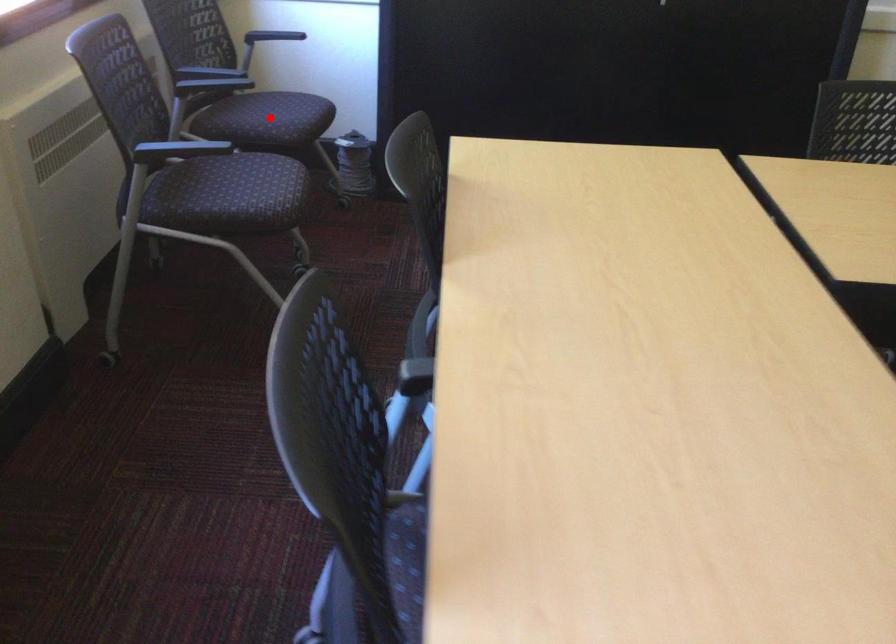
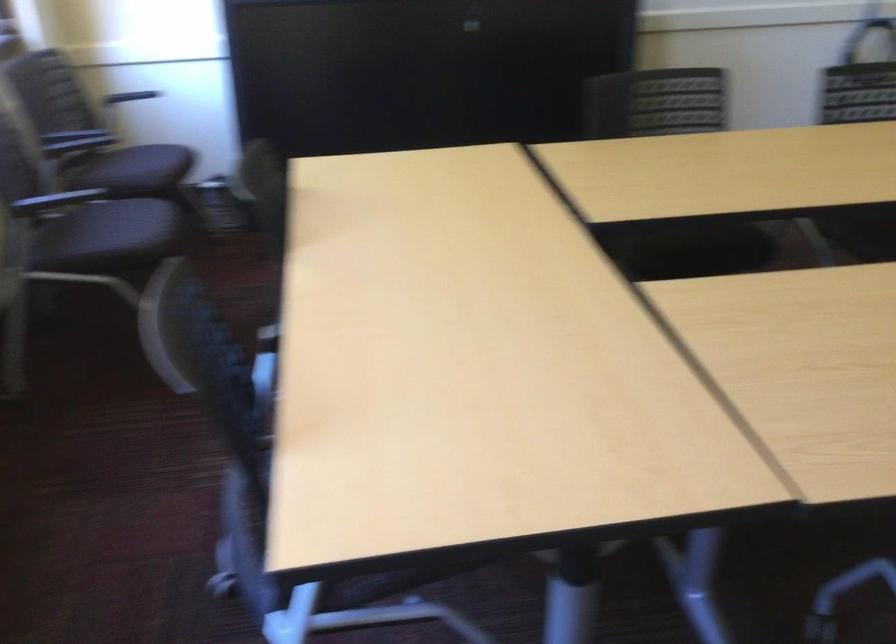
Question: I am providing you with two images of the same scene from different viewpoints. Given a red point in image1, look at the same physical point in image2. Is it:

Choices:
 (A) Closer to the viewpoint
 (B) Farther from the viewpoint

Answer: (B)